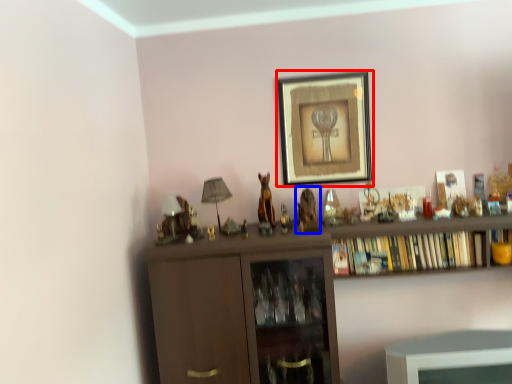
Question: Which object is further to the camera taking this photo, picture frame (highlighted by a red box) or animal (highlighted by a blue box)?

Choices:
 (A) picture frame
 (B) animal

Answer: (A)